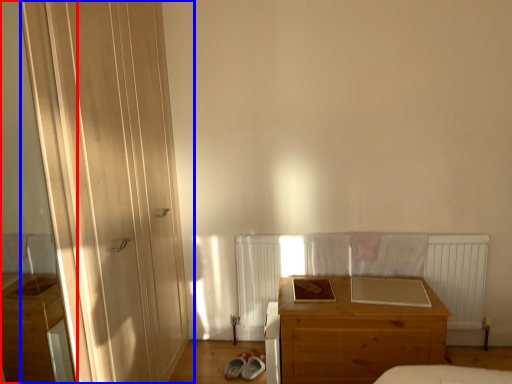
Question: Among these objects, which one is nearest to the camera, screen door (highlighted by a red box) or door (highlighted by a blue box)?

Choices:
 (A) screen door
 (B) door

Answer: (A)